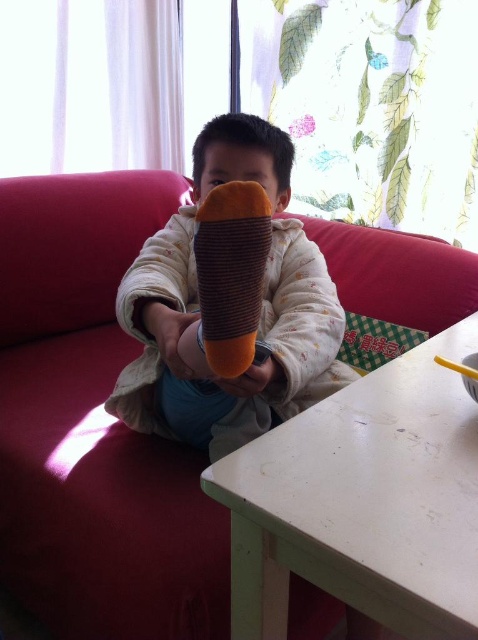
You are a parent trying to place a small book on the white matte table at lower center. However, the soft plush toy at center is currently on the table. What should you do to make space?

The white matte table at lower center has a lesser height compared to the soft plush toy at center, so you should move the soft plush toy at center off the table to create space for the book.

You are a parent who wants to place a small book on the white matte table at lower center. However, there is a soft plush toy at center in the way. Can you move the plush toy to make space for the book?

The white matte table at lower center is positioned under the soft plush toy at center, so moving the soft plush toy at center would allow access to the table to place the book.